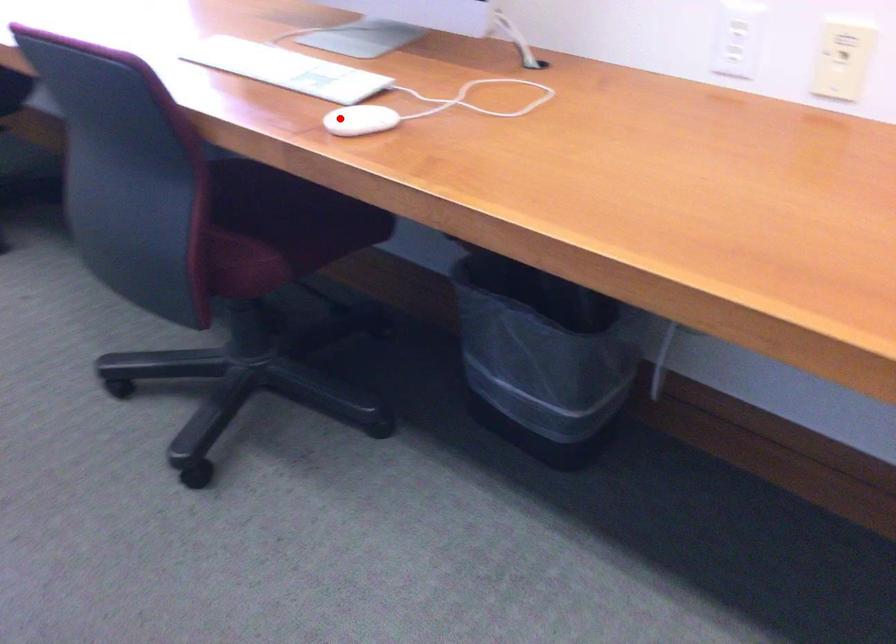
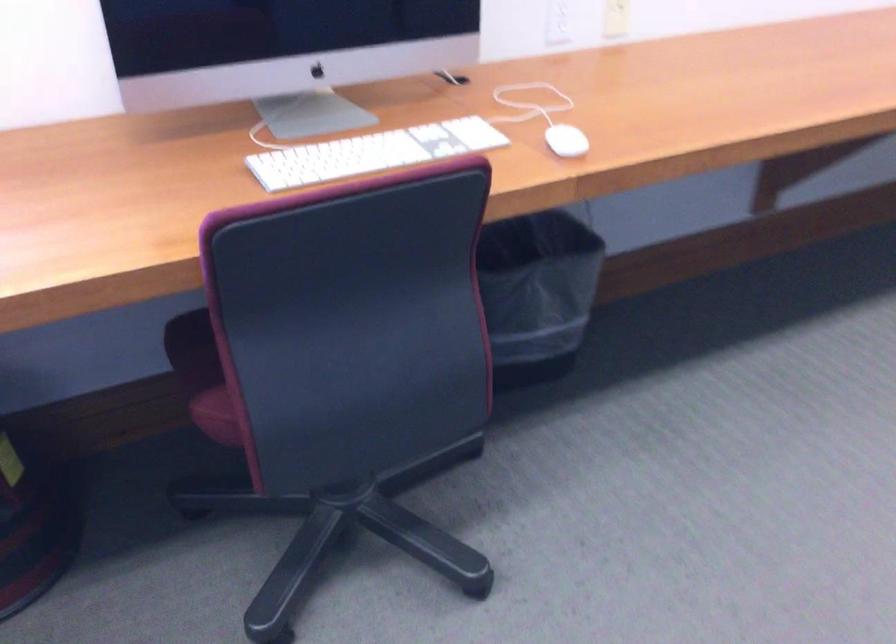
In the second image, find the point that corresponds to the highlighted location in the first image.

(565, 140)